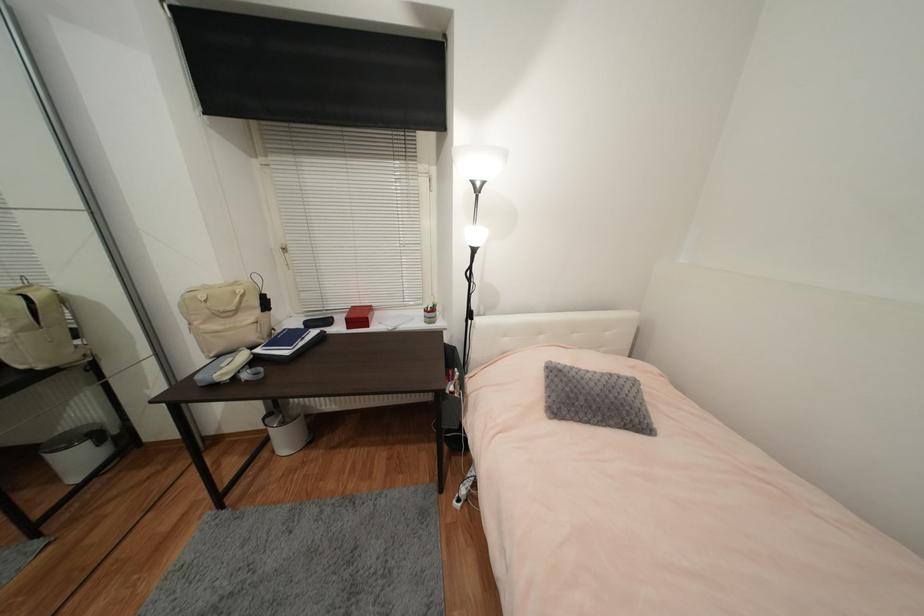
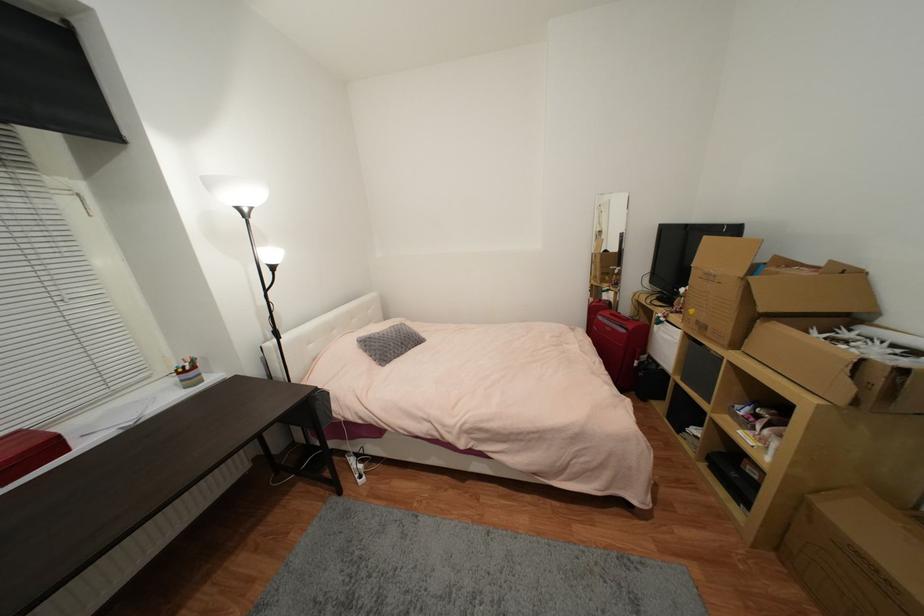
Question: The camera is either moving clockwise (left) or counter-clockwise (right) around the object. The first image is from the beginning of the video and the second image is from the end. Is the camera moving left or right when shooting the video?

Choices:
 (A) Left
 (B) Right

Answer: (A)